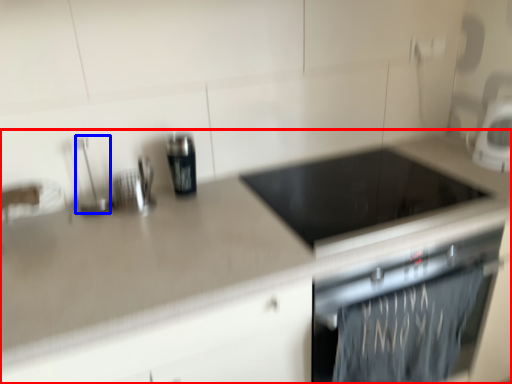
Question: Among these objects, which one is farthest to the camera, countertop (highlighted by a red box) or appliance (highlighted by a blue box)?

Choices:
 (A) countertop
 (B) appliance

Answer: (B)